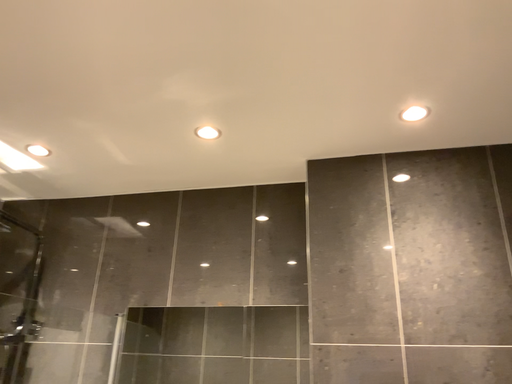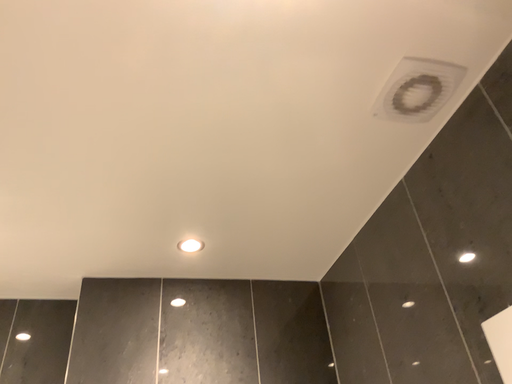
Question: Which way did the camera rotate in the video?

Choices:
 (A) rotated right
 (B) rotated left

Answer: (A)